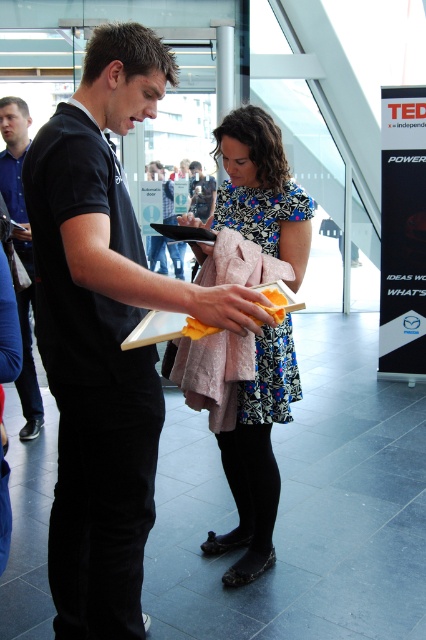
Is black matte shirt at center to the right of floral dress at center from the viewer's perspective?

Incorrect, black matte shirt at center is not on the right side of floral dress at center.

The height and width of the screenshot is (640, 426). In order to click on black matte shirt at center in this screenshot , I will do `click(104, 333)`.

Locate an element on the screen. Image resolution: width=426 pixels, height=640 pixels. black matte shirt at center is located at coordinates (104, 333).

Based on the photo, which is below, black matte shirt at center or blue shirt at left?

black matte shirt at center is lower down.

Is black matte shirt at center wider than blue shirt at left?

Correct, the width of black matte shirt at center exceeds that of blue shirt at left.

Who is more distant from viewer, (54, 492) or (16, 99)?

The point (16, 99) is more distant.

At what (x,y) coordinates should I click in order to perform the action: click on black matte shirt at center. Please return your answer as a coordinate pair (x, y). Looking at the image, I should click on (104, 333).

Can you confirm if floral dress at center is thinner than blue shirt at left?

Incorrect, floral dress at center's width is not less than blue shirt at left's.

Does floral dress at center have a greater height compared to blue shirt at left?

Incorrect, floral dress at center's height is not larger of blue shirt at left's.

What do you see at coordinates (256, 454) in the screenshot?
I see `floral dress at center` at bounding box center [256, 454].

This screenshot has width=426, height=640. Find the location of `floral dress at center`. floral dress at center is located at coordinates (256, 454).